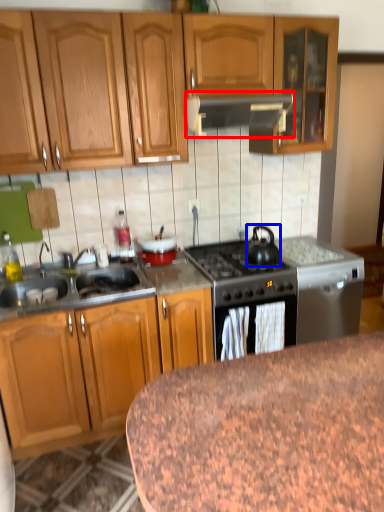
Question: Among these objects, which one is farthest to the camera, kitchen appliance (highlighted by a red box) or tea pot (highlighted by a blue box)?

Choices:
 (A) kitchen appliance
 (B) tea pot

Answer: (B)